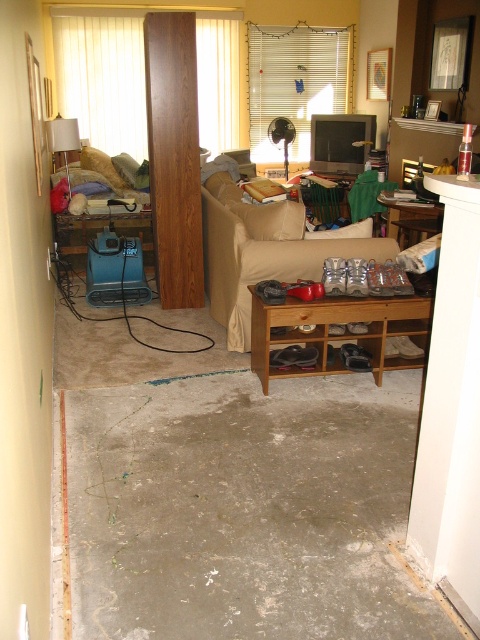
You are a contractor standing at the entrance of the living room. You need to locate the gray concrete floor at lower center. According to the coordinates provided, where exactly should you look to find it?

The gray concrete floor at lower center is located at the 2D coordinates point of (245, 509).

You are a contractor assessing the renovation site. You see the wooden shoe rack at center and the matte white lampshade at upper left. Which object is nearer to you as you stand at the entrance?

The wooden shoe rack at center is closer to the viewer than the matte white lampshade at upper left, so the wooden shoe rack at center is nearer.

You are helping to organize the living room and need to place a new rectangular storage box that is 1 meter wide. You have two options for placement areas near the wooden shoe rack at center and the matte white lampshade at upper left. Which object should you choose to ensure the storage box fits without exceeding its width?

The wooden shoe rack at center has a larger width than the matte white lampshade at upper left, so placing the storage box next to the wooden shoe rack at center would provide enough space since its width is greater than the 1 meter requirement.